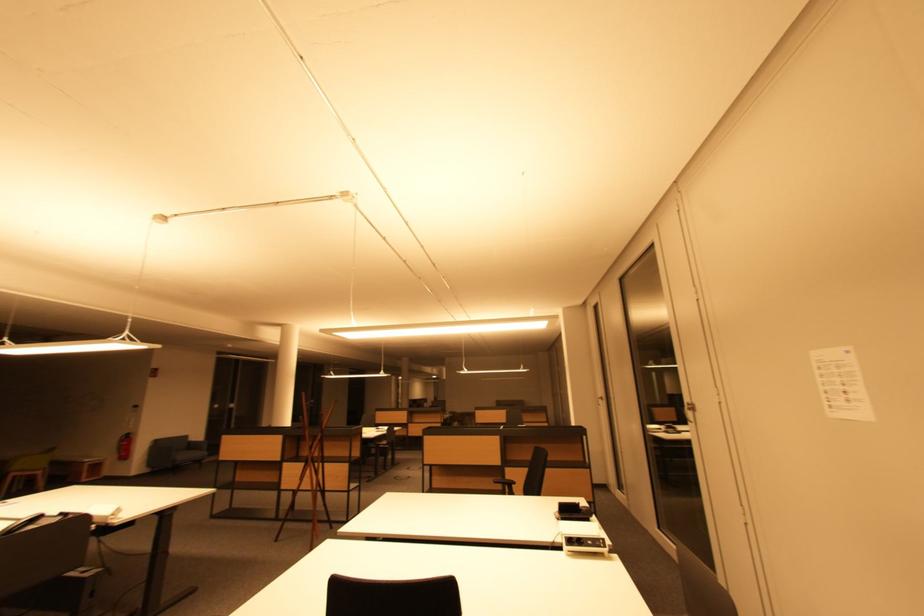
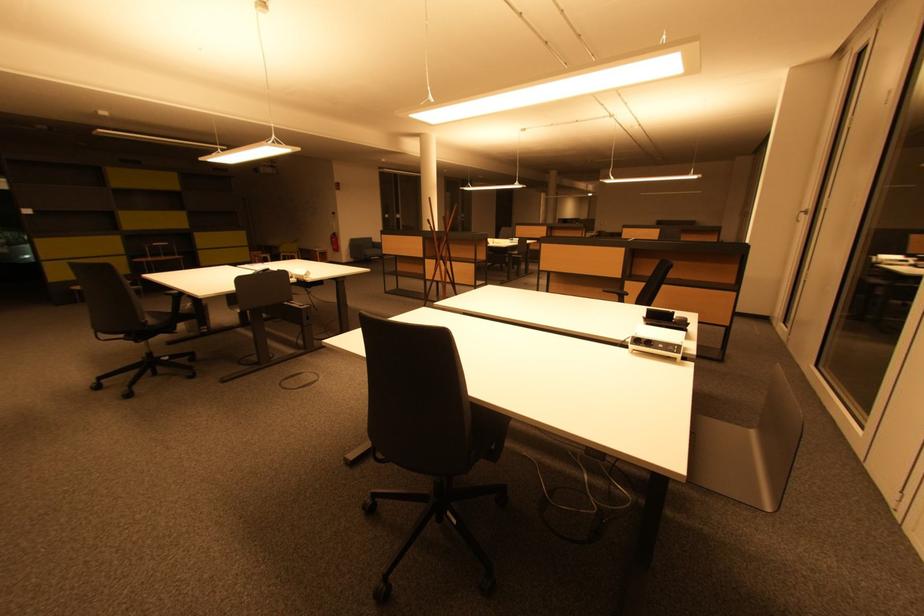
The images are taken continuously from a first-person perspective. In which direction is your viewpoint rotating?

The rotation direction of the camera is left-down.